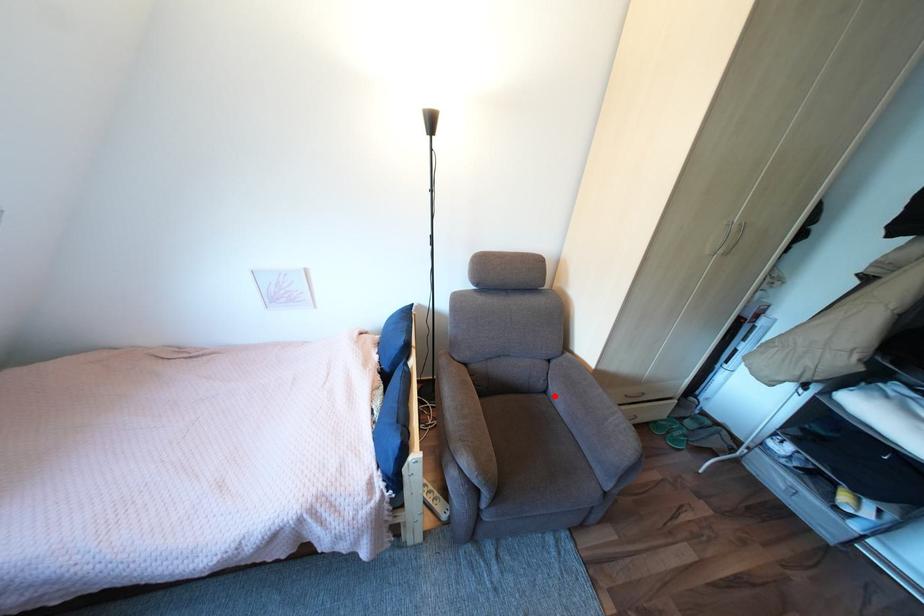
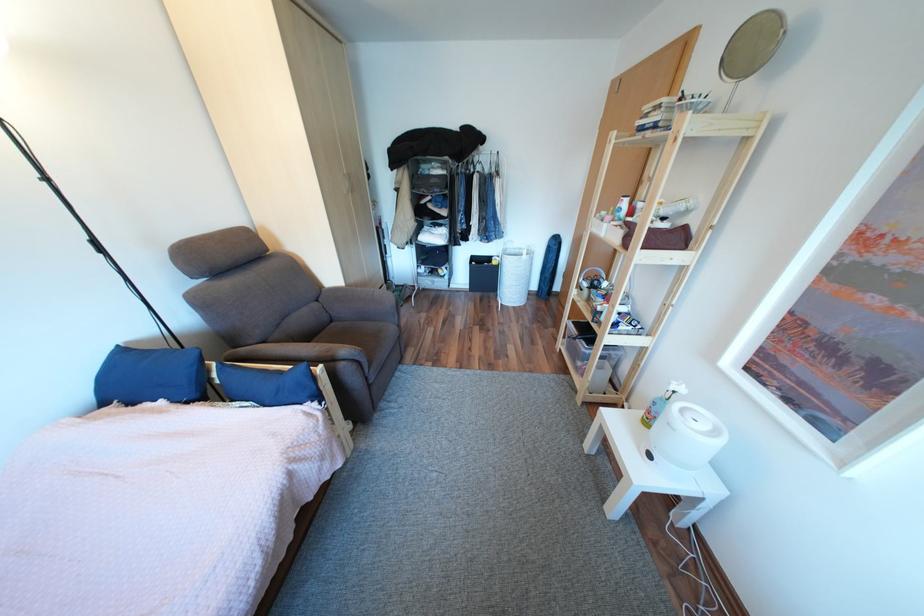
In the second image, find the point that corresponds to the highlighted location in the first image.

(344, 323)